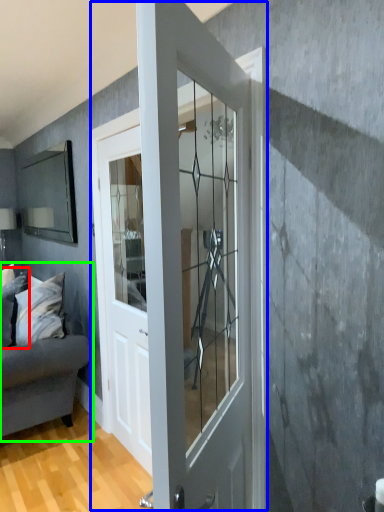
Question: Which object is positioned farthest from pillow (highlighted by a red box)? Select from door (highlighted by a blue box) and studio couch (highlighted by a green box).

Choices:
 (A) door
 (B) studio couch

Answer: (A)